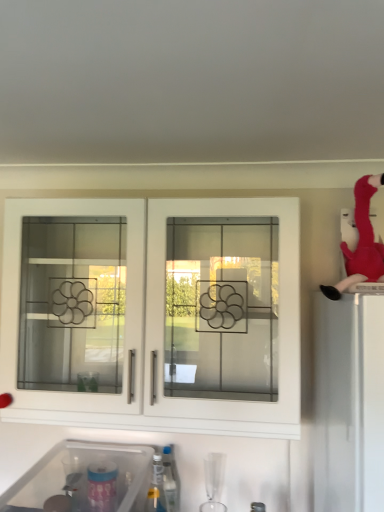
Question: In terms of width, does transparent plastic sink at lower left look wider or thinner when compared to white glass cabinet doors at center?

Choices:
 (A) wide
 (B) thin

Answer: (A)

Question: In terms of height, does transparent plastic sink at lower left look taller or shorter compared to white glass cabinet doors at center?

Choices:
 (A) short
 (B) tall

Answer: (A)

Question: Estimate the real-world distances between objects in this image. Which object is closer to the white glass cabinet doors at center?

Choices:
 (A) transparent plastic sink at lower left
 (B) translucent plastic bottle at lower center
 (C) velvet plush flamingo at upper right

Answer: (A)

Question: Which object is positioned closest to the translucent plastic bottle at lower center?

Choices:
 (A) transparent plastic sink at lower left
 (B) white glass cabinet doors at center
 (C) velvet plush flamingo at upper right

Answer: (A)